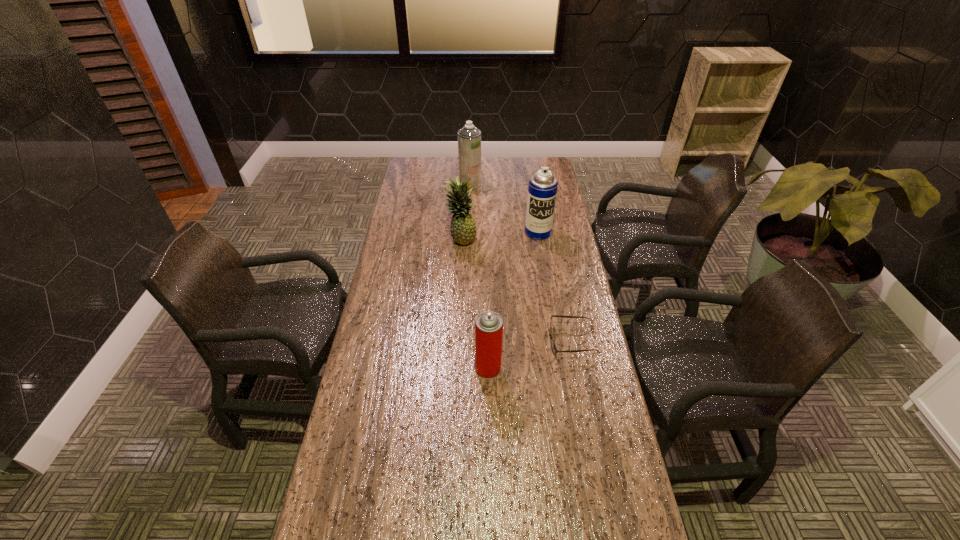
Select which aerosol can is the second closest to the farthest object. Please provide its 2D coordinates. Your answer should be formatted as a tuple, i.e. [(x, y)], where the tuple contains the x and y coordinates of a point satisfying the conditions above.

[(488, 325)]

Identify which aerosol can is the nearest to the pineapple. Please provide its 2D coordinates. Your answer should be formatted as a tuple, i.e. [(x, y)], where the tuple contains the x and y coordinates of a point satisfying the conditions above.

[(542, 190)]

Find the location of a particular element. The width and height of the screenshot is (960, 540). blank space that satisfies the following two spatial constraints: 1. on the front side of the second shortest object; 2. on the left side of the farthest object is located at coordinates pyautogui.click(x=465, y=368).

I want to click on vacant point that satisfies the following two spatial constraints: 1. on the lenses of the shortest object; 2. on the front side of the nearest aerosol can, so click(578, 368).